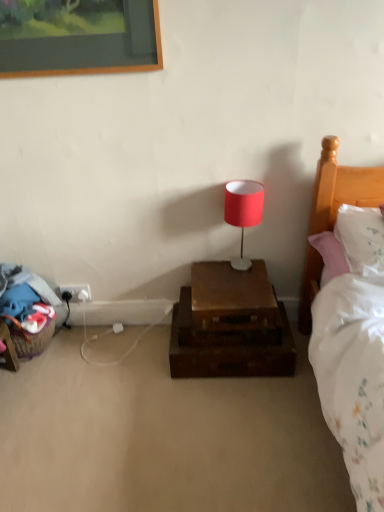
Question: From their relative heights in the image, would you say white plastic electrical outlet at lower left is taller or shorter than matte red lampshade at center?

Choices:
 (A) short
 (B) tall

Answer: (A)

Question: Considering the positions of point (82, 300) and point (251, 193), is point (82, 300) closer or farther from the camera than point (251, 193)?

Choices:
 (A) farther
 (B) closer

Answer: (A)

Question: Based on their relative distances, which object is farther from the wooden suitcase at center?

Choices:
 (A) white plastic electrical outlet at lower left
 (B) white soft pillow at right
 (C) matte red lampshade at center

Answer: (A)

Question: Which object is positioned closest to the white plastic electrical outlet at lower left?

Choices:
 (A) wooden suitcase at center
 (B) matte red lampshade at center
 (C) white soft pillow at right

Answer: (A)